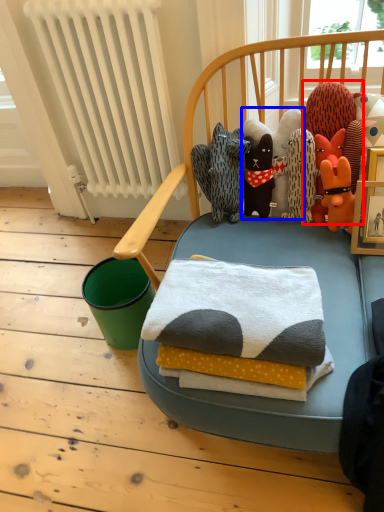
Question: Which point is further to the camera, toy (highlighted by a red box) or toy (highlighted by a blue box)?

Choices:
 (A) toy
 (B) toy

Answer: (B)